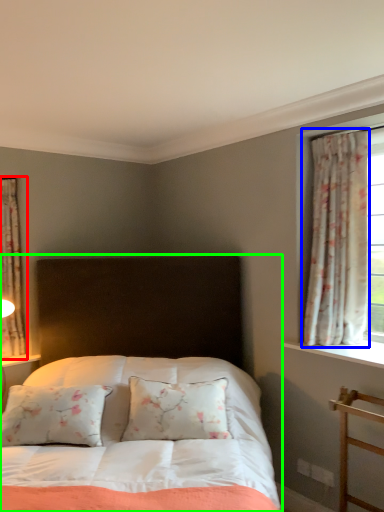
Question: Which object is positioned closest to curtain (highlighted by a red box)? Select from curtain (highlighted by a blue box) and bed (highlighted by a green box).

Choices:
 (A) curtain
 (B) bed

Answer: (B)